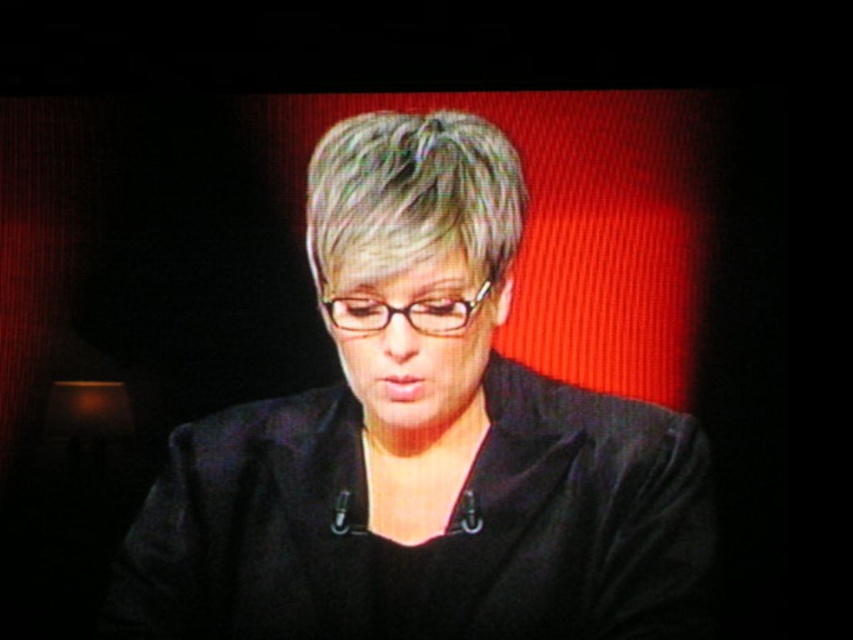
Question: Which object appears farthest from the camera in this image?

Choices:
 (A) gray matte hair at center
 (B) black plastic glasses at center

Answer: (B)

Question: Which point is farther to the camera?

Choices:
 (A) black matte jacket at center
 (B) black plastic glasses at center
 (C) gray matte hair at center

Answer: (B)

Question: Which object appears closest to the camera in this image?

Choices:
 (A) black matte jacket at center
 (B) gray matte hair at center
 (C) black plastic glasses at center

Answer: (B)

Question: Where is black matte jacket at center located in relation to gray matte hair at center in the image?

Choices:
 (A) left
 (B) right

Answer: (A)

Question: Does black matte jacket at center have a greater width compared to gray matte hair at center?

Choices:
 (A) yes
 (B) no

Answer: (A)

Question: Observing the image, what is the correct spatial positioning of black matte jacket at center in reference to gray matte hair at center?

Choices:
 (A) right
 (B) left

Answer: (B)